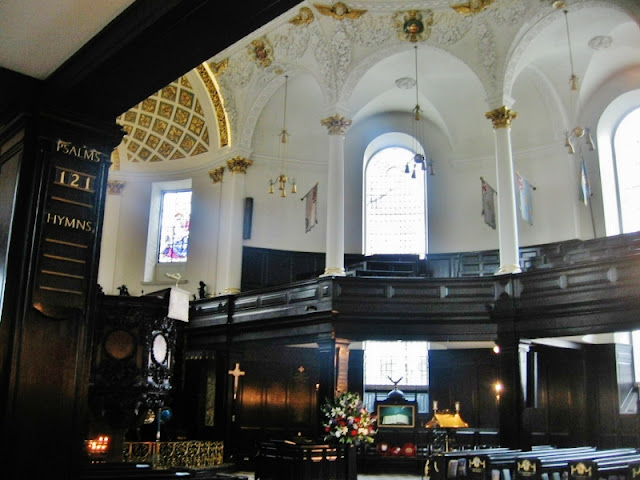
I want to click on balcony seats, so (595, 255), (607, 242).